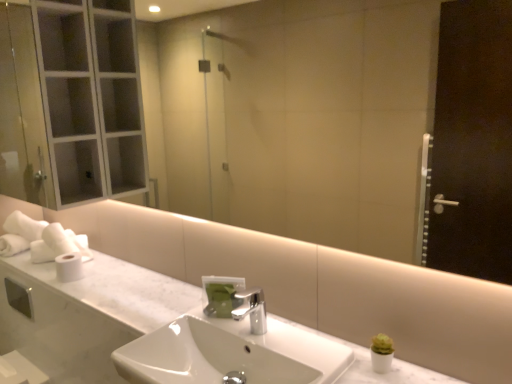
The image size is (512, 384). What are the coordinates of `blank area to the left of white matte toilet paper at left, which ranks as the second toilet paper in back-to-front order` in the screenshot? It's located at (39, 271).